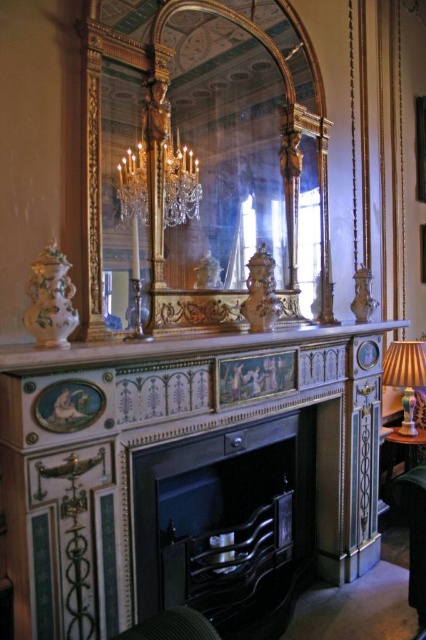
You are an interior designer planning to place a decorative item on the mantel. The item requires a space wider than the matte gold lampshade at right. Can the white marble mantelpiece at center accommodate this item?

The white marble mantelpiece at center has a larger width than the matte gold lampshade at right, so it can accommodate the decorative item requiring more space.

You are a guest in this historic room and want to place a tall vase on the wooden table at lower right. The vase is taller than the matte gold lampshade at right. Will the vase fit on the table without exceeding its height?

The matte gold lampshade at right is much taller than the wooden table at lower right. Since the vase is taller than the lampshade, it will exceed the table height and not fit properly.